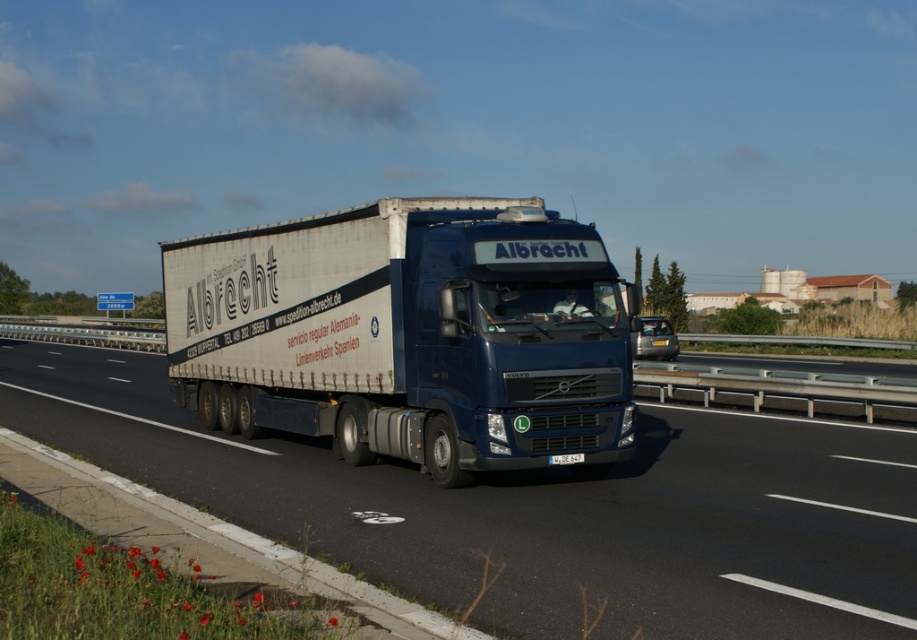
You are standing at the origin point of the image coordinate system. The white matte truck at center is located at point (538, 512). If you want to walk directly to the white matte truck at center, which direction should you move in?

Since the white matte truck at center is located at point (538, 512), you should move towards the center of the image to reach it.

You are a photographer trying to capture both the white matte truck at center and the matte blue truck at center in a single shot. Given their sizes, which truck will appear closer to the camera in the photo?

The white matte truck at center is smaller than the matte blue truck at center, so the matte blue truck at center will appear closer to the camera in the photo because larger objects in a photo typically appear closer.

You are a photographer planning to capture the white matte truck at center and the matte blue truck at center in a single frame. Given that your camera can only capture objects within a 3.5 meter width, can both trucks fit side by side in the frame?

The white matte truck at center is wider than the matte blue truck at center. However, without knowing the exact widths of both trucks, it is impossible to determine if their combined width exceeds 3.5 meters. Additional information about each truck is needed to answer this question.